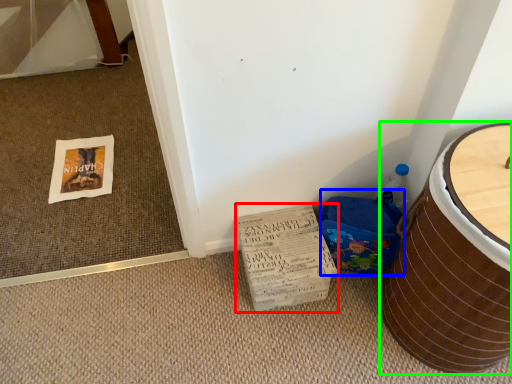
Question: Which object is the farthest from cardboard (highlighted by a red box)? Choose among these: potty (highlighted by a blue box) or furniture (highlighted by a green box).

Choices:
 (A) potty
 (B) furniture

Answer: (B)